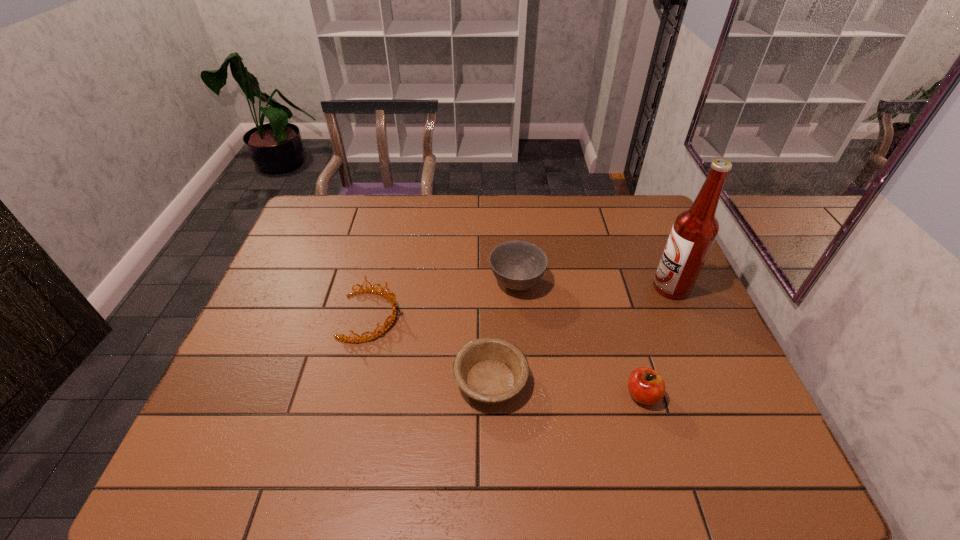
Find the location of a particular element. This screenshot has width=960, height=540. free space located on the back of the taller bowl is located at coordinates click(x=514, y=248).

Where is `vacant space located 0.360m on the front-facing side of the leftmost object`? This screenshot has width=960, height=540. vacant space located 0.360m on the front-facing side of the leftmost object is located at coordinates (530, 316).

This screenshot has width=960, height=540. Find the location of `free spot located 0.340m on the back of the apple`. free spot located 0.340m on the back of the apple is located at coordinates (609, 281).

Locate an element on the screen. free space located on the right of the nearer bowl is located at coordinates (556, 381).

You are a GUI agent. You are given a task and a screenshot of the screen. Output one action in this format:
    pyautogui.click(x=<x>, y=<y>)
    Task: Click on the object that is at the right edge
    
    Given the screenshot: What is the action you would take?
    pyautogui.click(x=694, y=231)

You are a GUI agent. You are given a task and a screenshot of the screen. Output one action in this format:
    pyautogui.click(x=<x>, y=<y>)
    Task: Click on the vacant region at the far edge of the desktop
    
    Given the screenshot: What is the action you would take?
    pyautogui.click(x=399, y=196)

The height and width of the screenshot is (540, 960). What are the coordinates of `free location at the left edge of the desktop` in the screenshot? It's located at (324, 240).

Where is `free spot at the right edge of the desktop`? This screenshot has width=960, height=540. free spot at the right edge of the desktop is located at coordinates (724, 403).

Locate an element on the screen. Image resolution: width=960 pixels, height=540 pixels. vacant region at the far left corner is located at coordinates (324, 219).

This screenshot has width=960, height=540. I want to click on vacant space at the near left corner, so click(191, 463).